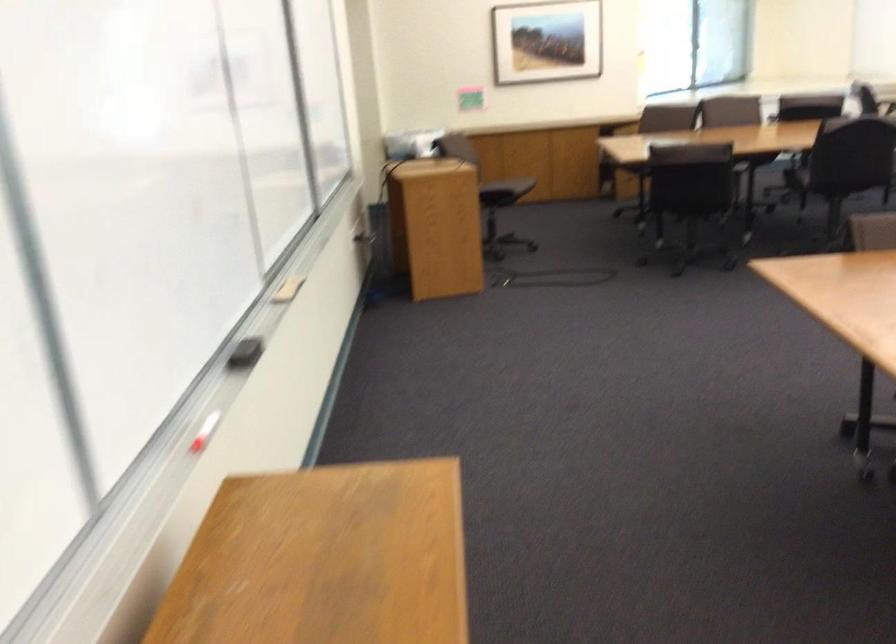
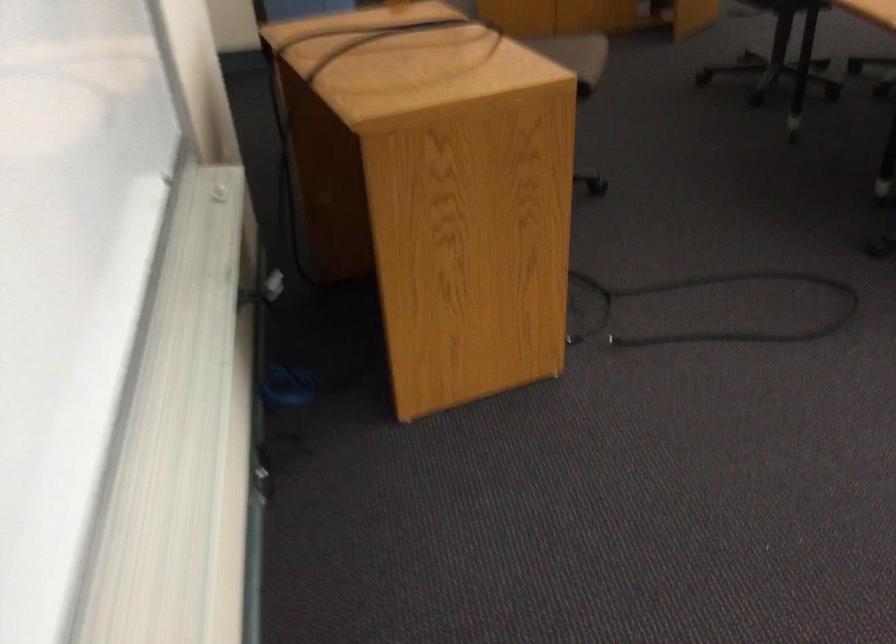
Question: In a continuous first-person perspective shot, in which direction is the camera moving?

Choices:
 (A) Left
 (B) Right
 (C) Forward
 (D) Backward

Answer: (C)